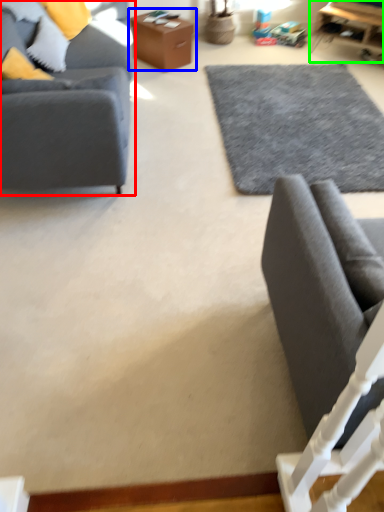
Question: Based on their relative distances, which object is nearer to studio couch (highlighted by a red box)? Choose from table (highlighted by a blue box) and table (highlighted by a green box).

Choices:
 (A) table
 (B) table

Answer: (A)